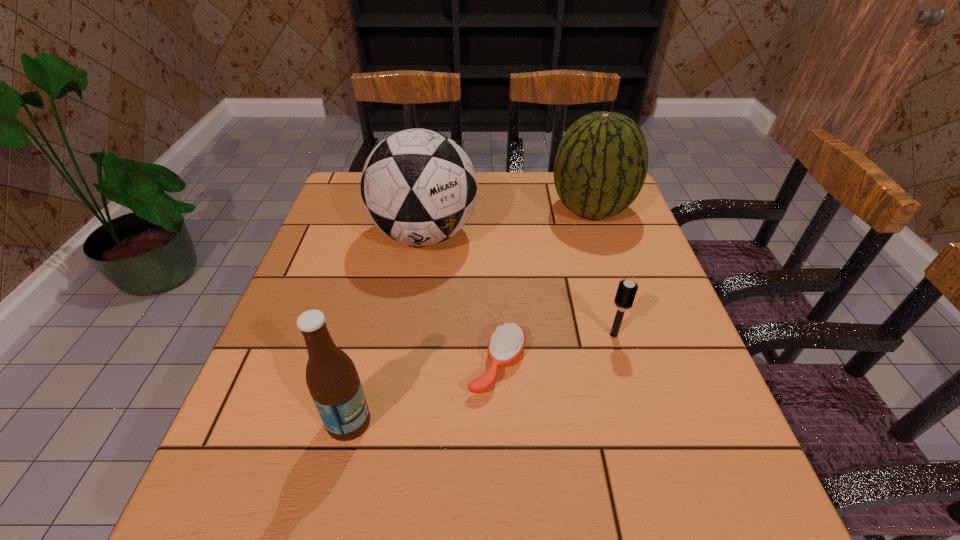
You are a GUI agent. You are given a task and a screenshot of the screen. Output one action in this format:
    pyautogui.click(x=<x>, y=<y>)
    Task: Click on the vacant area that lies between the beer bottle and the soccer ball
    The image size is (960, 540).
    Given the screenshot: What is the action you would take?
    pyautogui.click(x=387, y=328)

Locate an element on the screen. free space between the watermelon and the right hairbrush is located at coordinates (602, 272).

Where is `empty space between the watermelon and the left hairbrush`? This screenshot has width=960, height=540. empty space between the watermelon and the left hairbrush is located at coordinates (544, 287).

Identify which object is located as the third nearest to the shortest object. Please provide its 2D coordinates. Your answer should be formatted as a tuple, i.e. [(x, y)], where the tuple contains the x and y coordinates of a point satisfying the conditions above.

[(419, 187)]

At what (x,y) coordinates should I click in order to perform the action: click on object that is the closest one to the nearest object. Please return your answer as a coordinate pair (x, y). Image resolution: width=960 pixels, height=540 pixels. Looking at the image, I should click on (506, 344).

Where is `free space that satisfies the following two spatial constraints: 1. on the surface of the soccer ball where the brand logo is visible; 2. on the left side of the left hairbrush`? free space that satisfies the following two spatial constraints: 1. on the surface of the soccer ball where the brand logo is visible; 2. on the left side of the left hairbrush is located at coordinates (405, 364).

Where is `vacant space that satisfies the following two spatial constraints: 1. on the back side of the beer bottle; 2. on the right side of the right hairbrush`? vacant space that satisfies the following two spatial constraints: 1. on the back side of the beer bottle; 2. on the right side of the right hairbrush is located at coordinates (370, 334).

Locate an element on the screen. The height and width of the screenshot is (540, 960). vacant point that satisfies the following two spatial constraints: 1. on the surface of the right hairbrush where the brand logo is visible; 2. on the left side of the soccer ball is located at coordinates (410, 334).

The width and height of the screenshot is (960, 540). Identify the location of vacant point that satisfies the following two spatial constraints: 1. on the back side of the beer bottle; 2. on the right side of the watermelon. (398, 210).